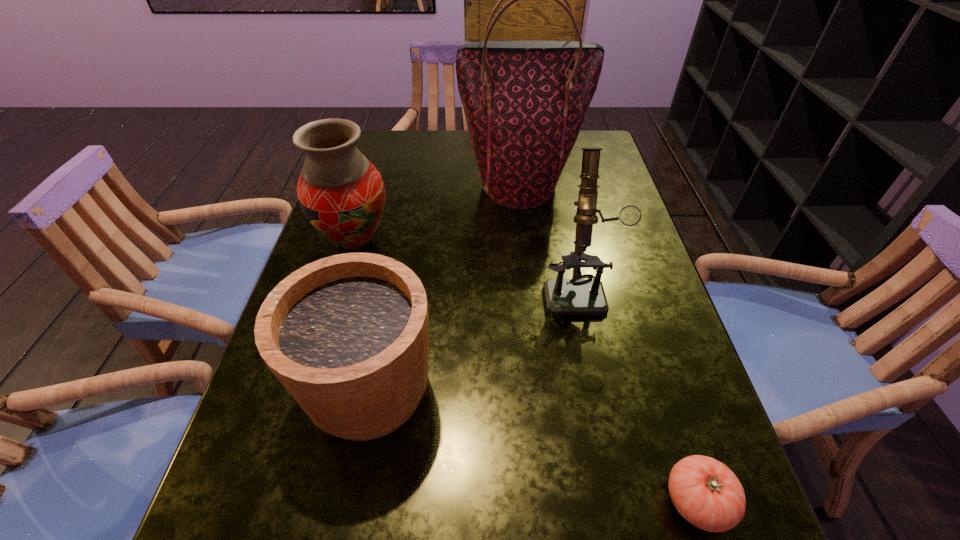
Find the location of a particular element. The width and height of the screenshot is (960, 540). free space located 0.190m on the back of the vase is located at coordinates (374, 176).

Image resolution: width=960 pixels, height=540 pixels. In order to click on free location located on the back of the second nearest object in this screenshot , I will do `click(395, 258)`.

Locate an element on the screen. The width and height of the screenshot is (960, 540). blank area located 0.380m on the back of the shortest object is located at coordinates (630, 288).

At what (x,y) coordinates should I click in order to perform the action: click on object that is at the far edge. Please return your answer as a coordinate pair (x, y). This screenshot has width=960, height=540. Looking at the image, I should click on (524, 101).

You are a GUI agent. You are given a task and a screenshot of the screen. Output one action in this format:
    pyautogui.click(x=<x>, y=<y>)
    Task: Click on the object that is positioned at the near edge
    The width and height of the screenshot is (960, 540).
    Given the screenshot: What is the action you would take?
    pyautogui.click(x=705, y=492)

Where is `vase located in the left edge section of the desktop`? The height and width of the screenshot is (540, 960). vase located in the left edge section of the desktop is located at coordinates point(341,193).

Where is `flowerpot at the left edge`? The image size is (960, 540). flowerpot at the left edge is located at coordinates (347, 335).

This screenshot has width=960, height=540. Identify the location of handbag located at the right edge. (524, 101).

At what (x,y) coordinates should I click in order to perform the action: click on microscope located at the right edge. Please return your answer as a coordinate pair (x, y). Looking at the image, I should click on (580, 295).

Image resolution: width=960 pixels, height=540 pixels. Find the location of `tomato at the right edge`. tomato at the right edge is located at coordinates (705, 492).